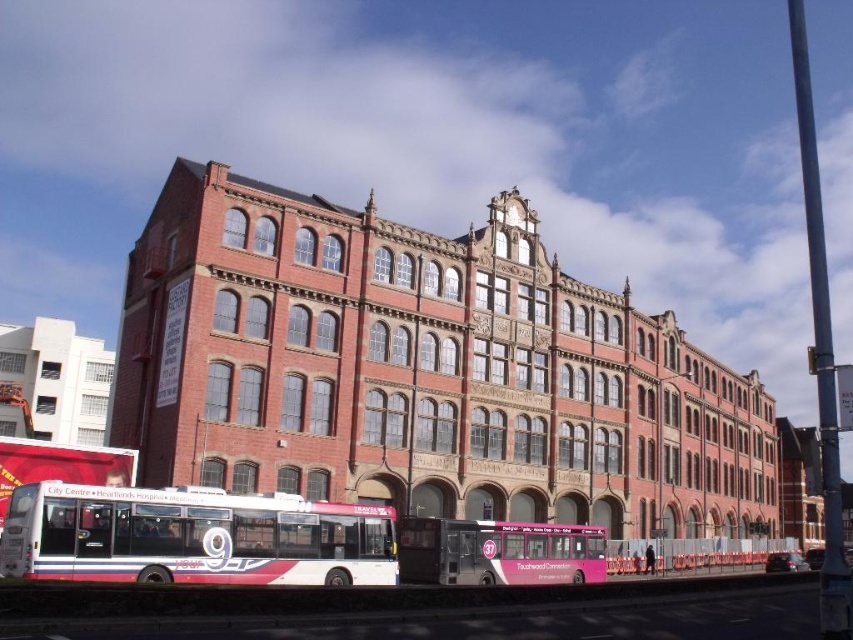
Question: Can you confirm if white glossy bus at lower left is positioned below pink matte bus at center?

Choices:
 (A) no
 (B) yes

Answer: (A)

Question: Which of the following is the farthest from the observer?

Choices:
 (A) (454, 564)
 (B) (212, 504)

Answer: (A)

Question: Does white glossy bus at lower left come behind pink matte bus at center?

Choices:
 (A) no
 (B) yes

Answer: (A)

Question: Which point appears closest to the camera in this image?

Choices:
 (A) (16, 502)
 (B) (587, 560)

Answer: (A)

Question: Which point is farther from the camera taking this photo?

Choices:
 (A) [x=239, y=572]
 (B) [x=605, y=560]

Answer: (B)

Question: Where is white glossy bus at lower left located in relation to pink matte bus at center in the image?

Choices:
 (A) above
 (B) below

Answer: (A)